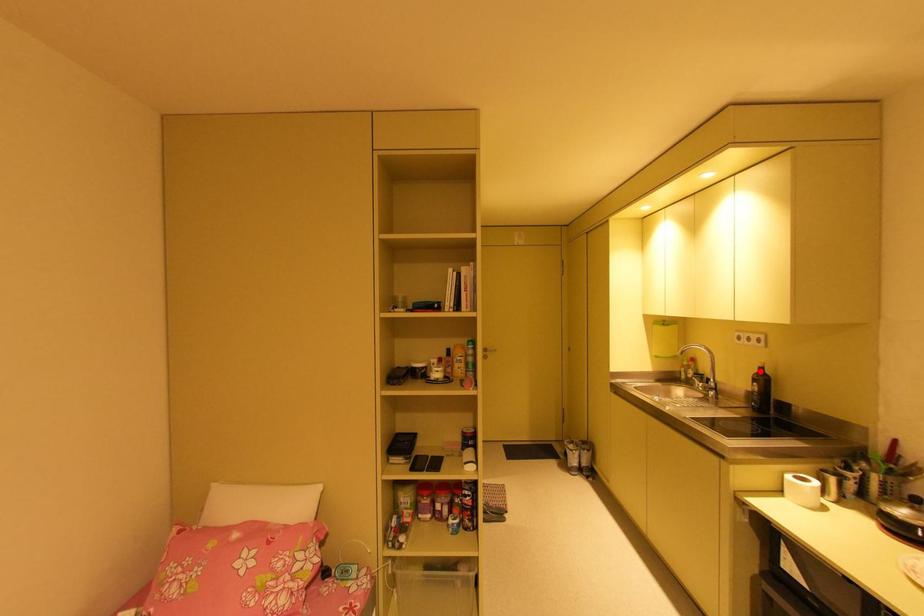
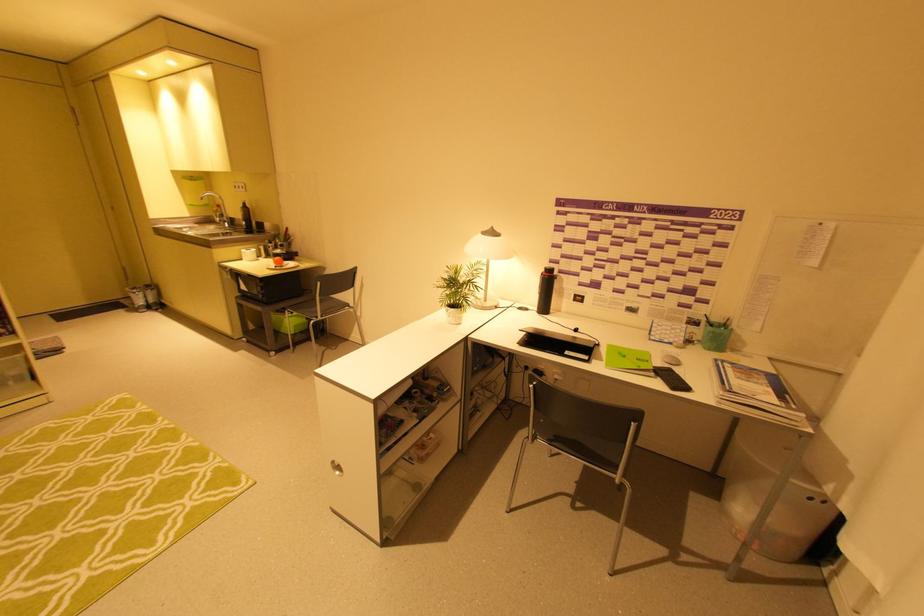
Question: I am providing you with two images of the same scene from different viewpoints. Given a red point in image1, look at the same physical point in image2. Is it:

Choices:
 (A) Closer to the viewpoint
 (B) Farther from the viewpoint

Answer: (A)